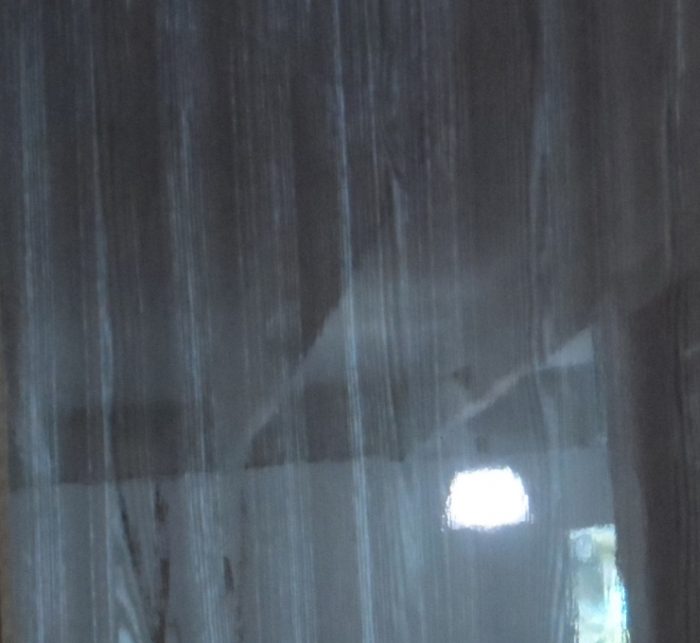
Image resolution: width=700 pixels, height=643 pixels. In order to click on ceiling in this screenshot , I will do `click(256, 404)`, `click(168, 318)`, `click(414, 300)`.